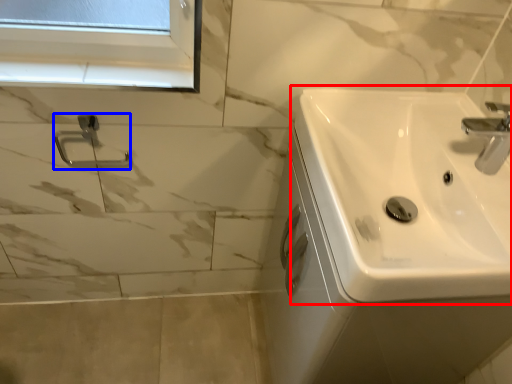
Question: Among these objects, which one is farthest to the camera, sink (highlighted by a red box) or shower (highlighted by a blue box)?

Choices:
 (A) sink
 (B) shower

Answer: (B)